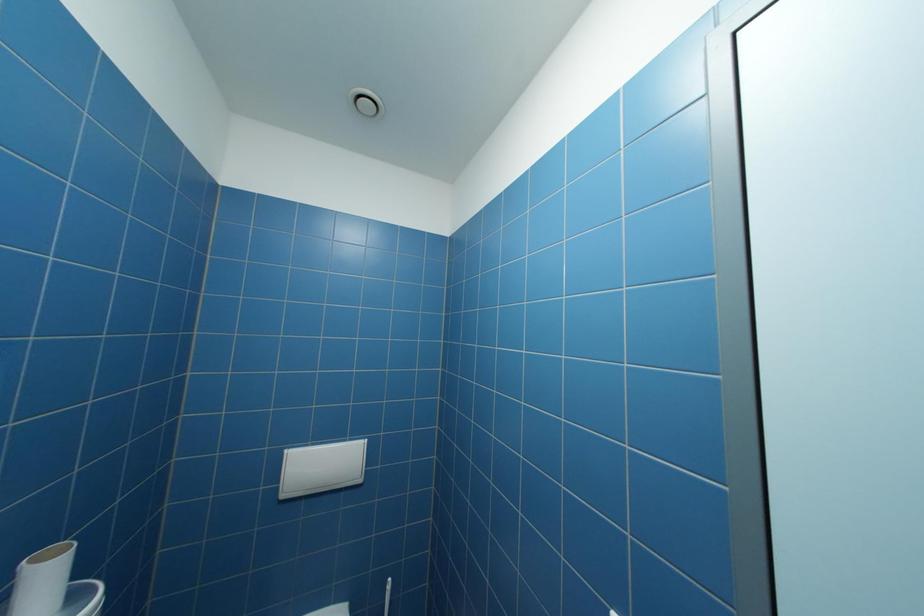
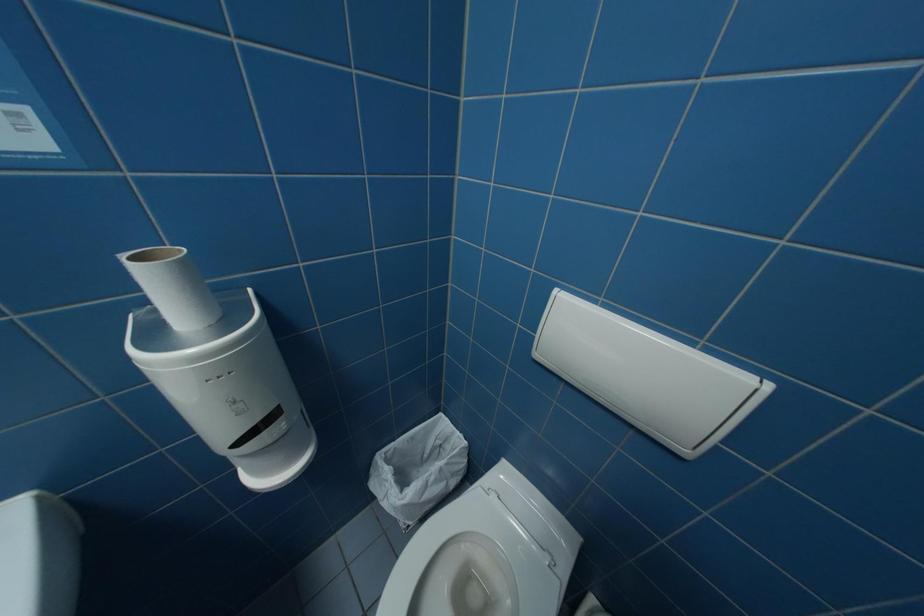
First-person continuous shooting, in which direction is the camera rotating?

The camera rotated toward left-down.